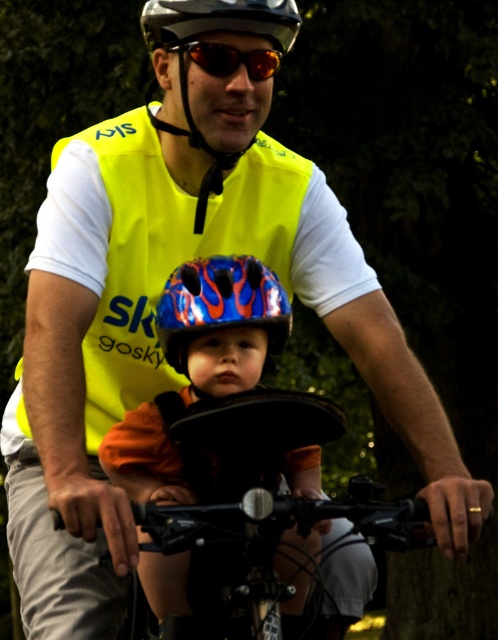
Question: Among these objects, which one is farthest from the camera?

Choices:
 (A) shiny black helmet at center
 (B) yellow reflective safety vest at center

Answer: (A)

Question: In this image, where is yellow reflective safety vest at center located relative to shiny metallic helmet at center?

Choices:
 (A) left
 (B) right

Answer: (A)

Question: Is shiny blue helmet at center in front of shiny orange plastic goggles at center?

Choices:
 (A) no
 (B) yes

Answer: (B)

Question: Does yellow reflective safety vest at center come behind blue glossy helmet at center?

Choices:
 (A) no
 (B) yes

Answer: (B)

Question: Which of the following is the closest to the observer?

Choices:
 (A) black metallic bicycle handlebars at center
 (B) shiny blue helmet at center
 (C) blue glossy helmet at center

Answer: (A)

Question: Which point is closer to the camera taking this photo?

Choices:
 (A) (169, 45)
 (B) (399, 513)

Answer: (B)